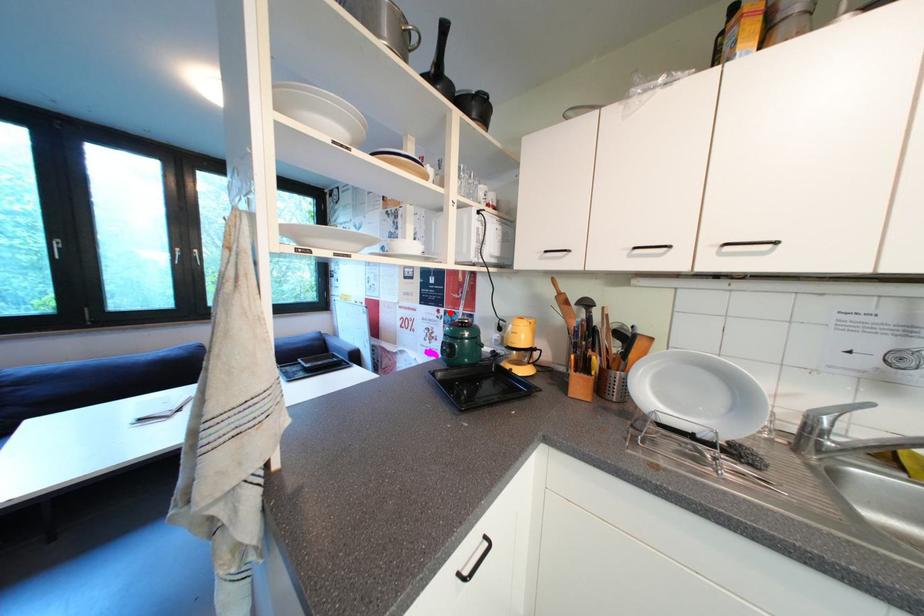
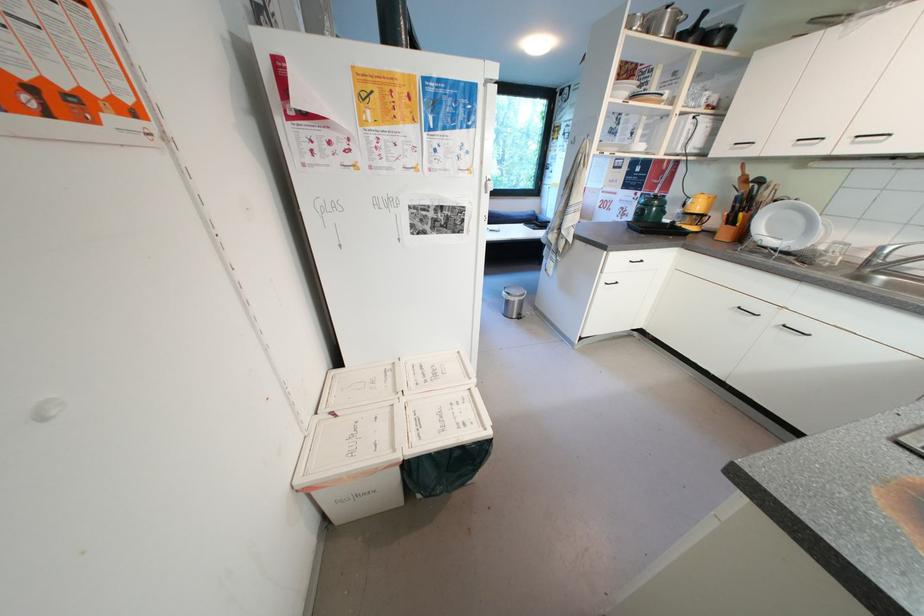
Find the pixel in the second image that matches the highlighted location in the first image.

(647, 196)